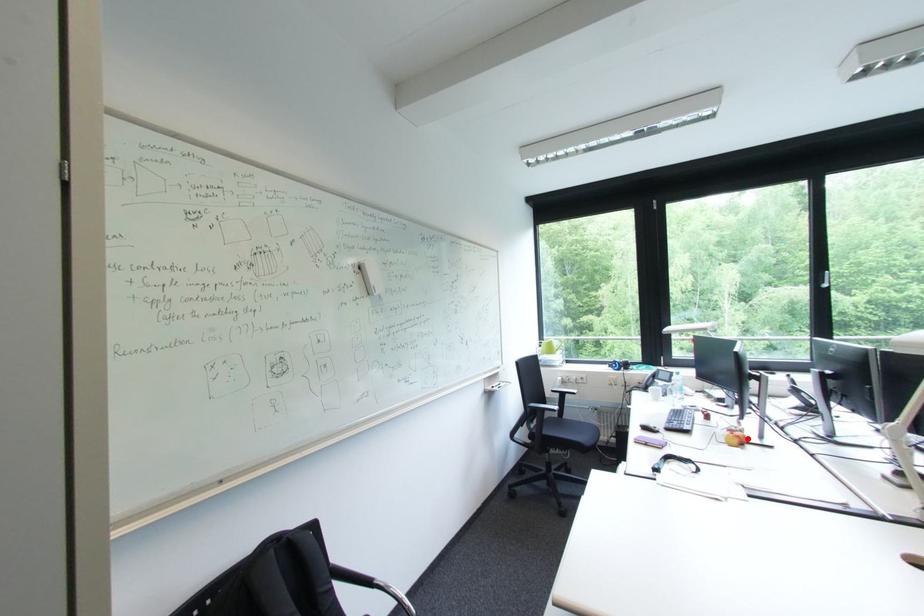
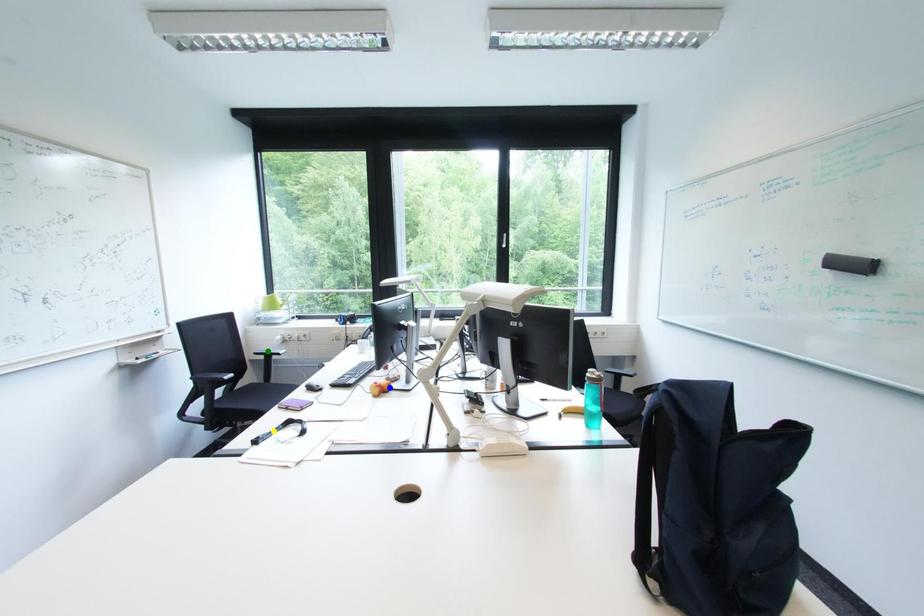
Question: I am providing you with two images of the same scene from different viewpoints. A red point is marked on the first image. You are given multiple points on the second image. Can you choose the point in image 2 that corresponds to the point in image 1?

Choices:
 (A) blue point
 (B) yellow point
 (C) green point

Answer: (A)